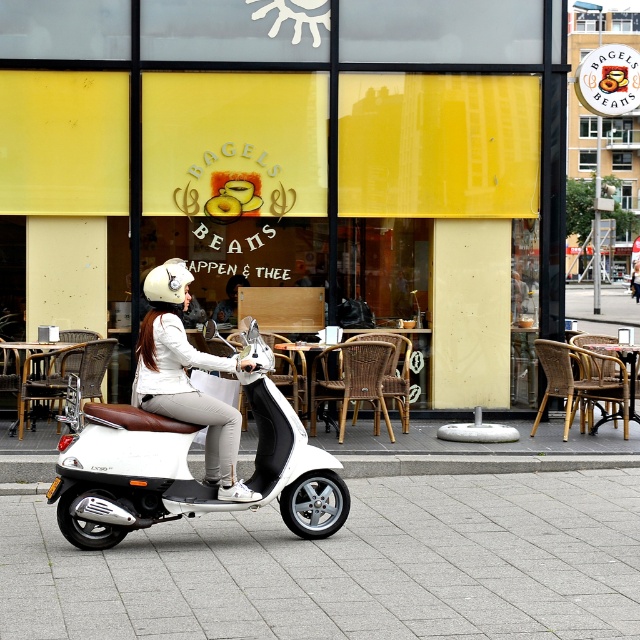
You are a customer at the Bagels and Beans cafe and want to sit near the yellow matte glass at center. Where should you look to find it?

The yellow matte glass at center is located at point (292, 168).

You are standing in front of the Bagels and Beans cafe and notice a point at coordinates (292, 168). Based on the scene description, what object is located at this point?

The point at coordinates (292, 168) corresponds to the yellow matte glass at center.